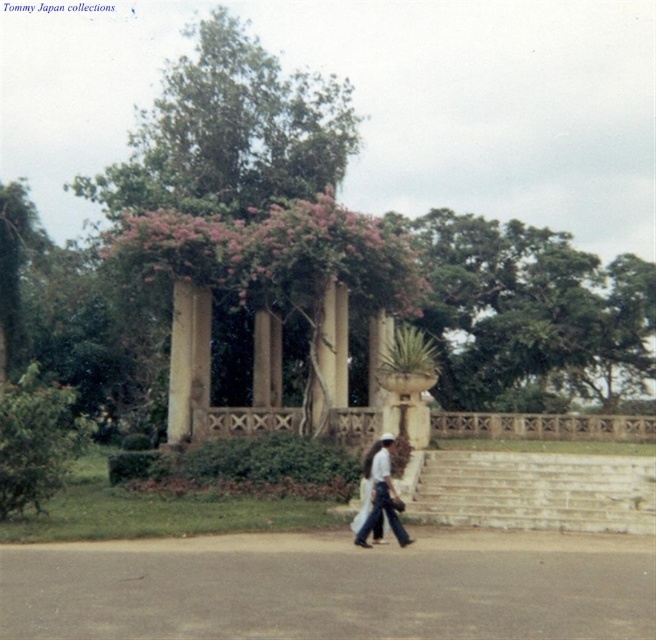
Is green leafy tree at upper center above white stone stairs at lower center?

Yes, green leafy tree at upper center is above white stone stairs at lower center.

Describe the element at coordinates (527, 308) in the screenshot. The image size is (656, 640). I see `green leafy tree at upper center` at that location.

Which is in front, point (564, 248) or point (453, 458)?

Point (453, 458) is in front.

Where is `green leafy tree at upper center`? The image size is (656, 640). green leafy tree at upper center is located at coordinates (527, 308).

Locate an element on the screen. The image size is (656, 640). beige stone gazebo at center is located at coordinates (272, 291).

Between beige stone gazebo at center and green leafy tree at upper center, which one appears on the left side from the viewer's perspective?

beige stone gazebo at center

This screenshot has width=656, height=640. What do you see at coordinates (272, 291) in the screenshot? I see `beige stone gazebo at center` at bounding box center [272, 291].

In order to click on beige stone gazebo at center in this screenshot , I will do `click(272, 291)`.

Does beige stone gazebo at center have a larger size compared to white cotton shirt at center?

Yes, beige stone gazebo at center is bigger than white cotton shirt at center.

Is point (340, 237) farther from camera compared to point (411, 541)?

Yes.

Find the location of a particular element. beige stone gazebo at center is located at coordinates (272, 291).